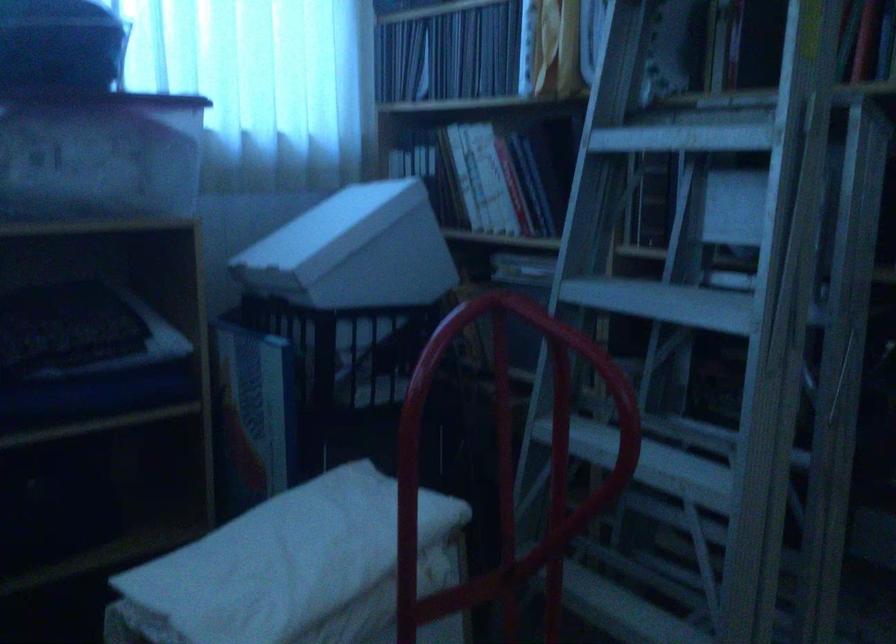
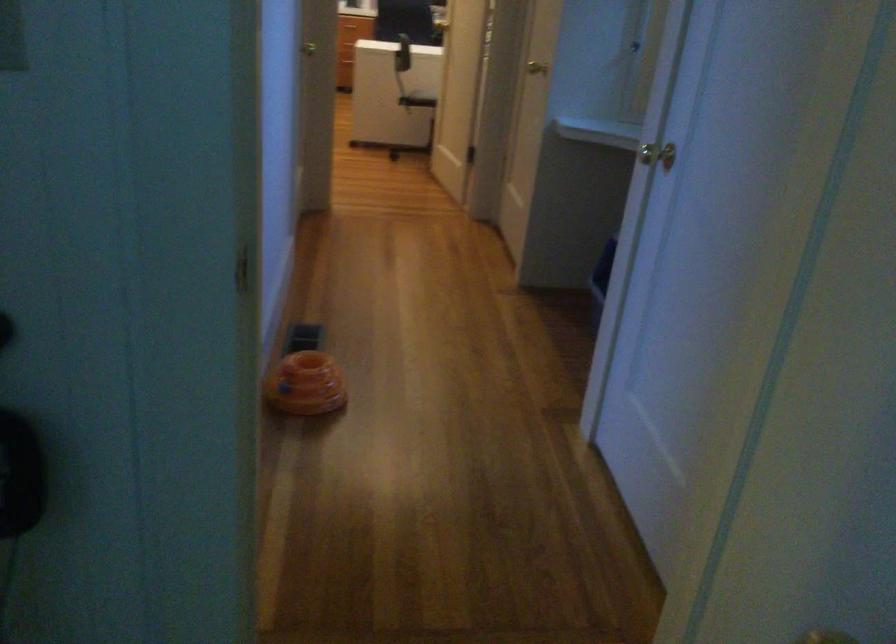
First-person continuous shooting, in which direction is the camera rotating?

The camera rotated toward right-down.